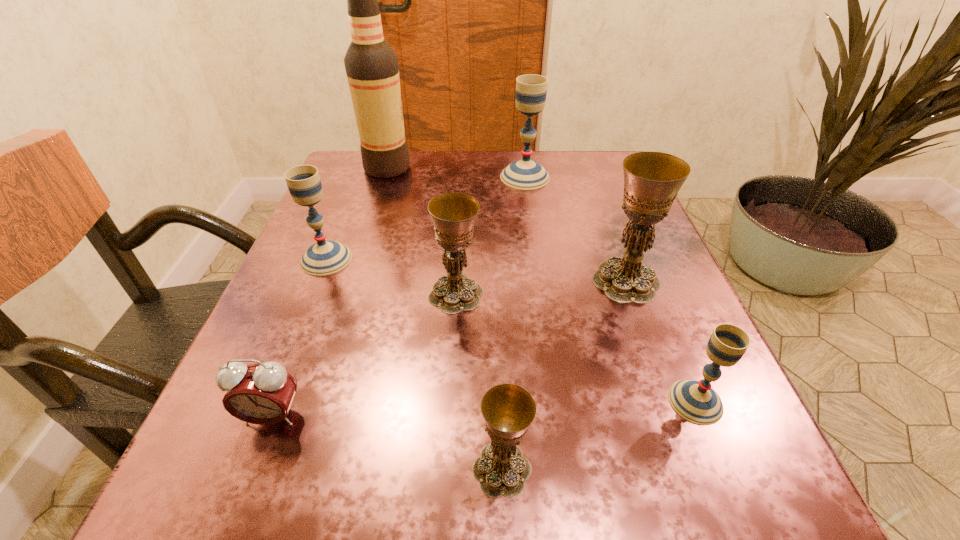
In order to click on the nearest gold chalice in this screenshot , I will do `click(508, 410)`.

Where is `the nearest chalice`? the nearest chalice is located at coordinates (508, 410).

This screenshot has width=960, height=540. I want to click on pink alarm clock, so click(262, 393).

Image resolution: width=960 pixels, height=540 pixels. What are the coordinates of `the shortest object` in the screenshot? It's located at (262, 393).

The width and height of the screenshot is (960, 540). I want to click on free space located 0.080m on the label of the beige alcohol, so click(x=444, y=168).

This screenshot has width=960, height=540. In order to click on free point located 0.060m on the back of the farthest chalice in this screenshot , I will do `click(521, 154)`.

Locate an element on the screen. This screenshot has height=540, width=960. free point located 0.150m on the left of the rightmost gold chalice is located at coordinates (507, 281).

Identify the location of free space located on the front of the second smallest gold chalice. (451, 376).

I want to click on free space located on the back of the second farthest gray chalice, so click(x=365, y=165).

The image size is (960, 540). What are the coordinates of `vacant area situated on the left of the second nearest chalice` in the screenshot? It's located at (508, 401).